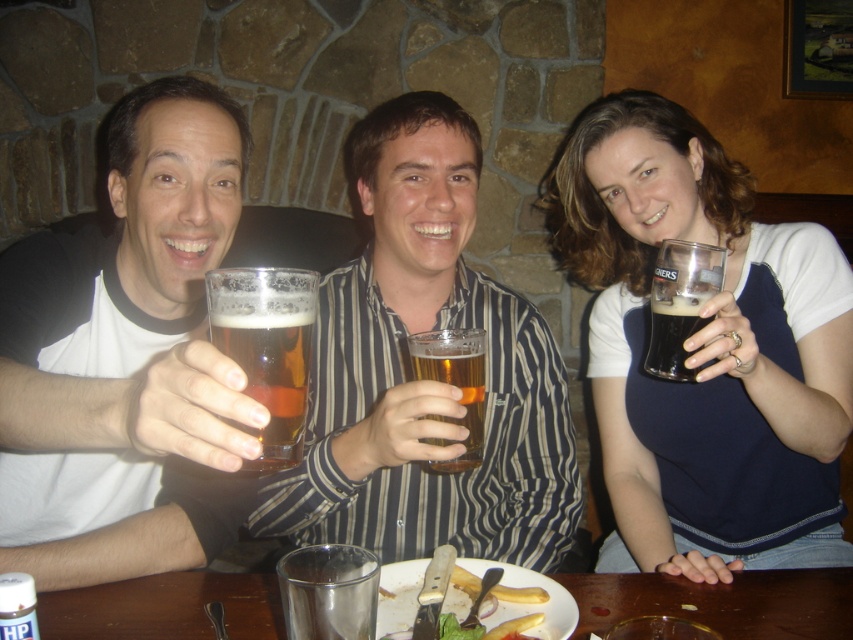
Between translucent glass mug at center and golden amber liquid at center, which one appears on the right side from the viewer's perspective?

From the viewer's perspective, golden amber liquid at center appears more on the right side.

Does translucent glass mug at center come behind golden amber liquid at center?

No.

What do you see at coordinates (425, 381) in the screenshot? I see `translucent glass mug at center` at bounding box center [425, 381].

What are the coordinates of `translucent glass mug at center` in the screenshot? It's located at (425, 381).

Which is more to the right, translucent glass mug at center or yellowish matte fries at lower center?

From the viewer's perspective, yellowish matte fries at lower center appears more on the right side.

Is translucent glass mug at center to the right of yellowish matte fries at lower center from the viewer's perspective?

No, translucent glass mug at center is not to the right of yellowish matte fries at lower center.

Who is more distant from viewer, (426, 259) or (383, 582)?

The point (426, 259) is behind.

Locate an element on the screen. translucent glass mug at center is located at coordinates 425,381.

This screenshot has height=640, width=853. What do you see at coordinates (722, 602) in the screenshot? I see `wooden table at center` at bounding box center [722, 602].

Can you confirm if wooden table at center is positioned to the left of translucent glass beer at center?

No, wooden table at center is not to the left of translucent glass beer at center.

You are a GUI agent. You are given a task and a screenshot of the screen. Output one action in this format:
    pyautogui.click(x=<x>, y=<y>)
    Task: Click on the wooden table at center
    The image size is (853, 640).
    Given the screenshot: What is the action you would take?
    pyautogui.click(x=722, y=602)